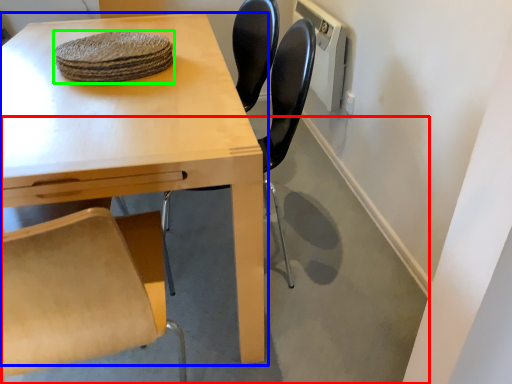
Question: Which object is positioned closest to concrete (highlighted by a red box)? Select from table (highlighted by a blue box) and food (highlighted by a green box).

Choices:
 (A) table
 (B) food

Answer: (A)